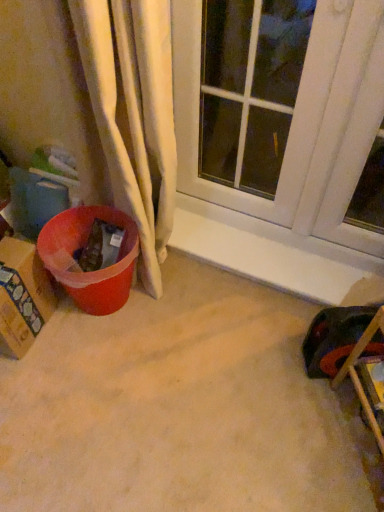
Question: Is point (339, 34) positioned closer to the camera than point (41, 306)?

Choices:
 (A) farther
 (B) closer

Answer: (B)

Question: From a real-world perspective, is white glass window at upper center positioned above or below cardboard box at left?

Choices:
 (A) above
 (B) below

Answer: (A)

Question: Which is nearer to the white glass window at upper center?

Choices:
 (A) cardboard box at left
 (B) white smooth window sill at center
 (C) wooden chair at lower right

Answer: (B)

Question: Which is farther from the cardboard box at left?

Choices:
 (A) white smooth window sill at center
 (B) wooden chair at lower right
 (C) white glass window at upper center

Answer: (B)